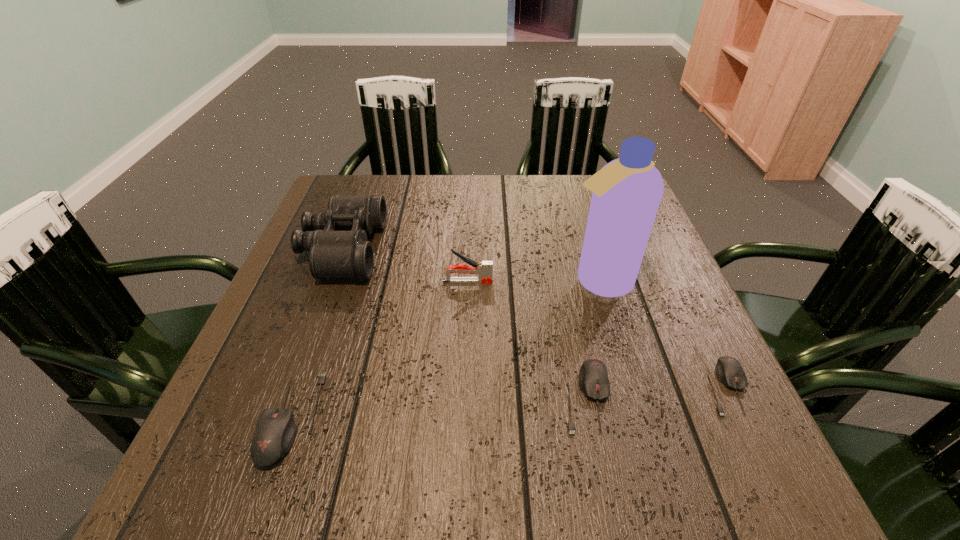
The width and height of the screenshot is (960, 540). In order to click on vacant region located 0.130m on the right of the second mouse from left to right in this screenshot , I will do `click(684, 397)`.

At what (x,y) coordinates should I click in order to perform the action: click on vacant space located 0.280m on the back of the rightmost object. Please return your answer as a coordinate pair (x, y). The width and height of the screenshot is (960, 540). Looking at the image, I should click on (667, 265).

The width and height of the screenshot is (960, 540). What are the coordinates of `free space located 0.060m on the handle side of the fourth object from right to left` in the screenshot? It's located at (518, 281).

At what (x,y) coordinates should I click in order to perform the action: click on vacant region located 0.100m at the eyepieces of the binoculars. Please return your answer as a coordinate pair (x, y). The image size is (960, 540). Looking at the image, I should click on (420, 248).

The height and width of the screenshot is (540, 960). I want to click on vacant area situated 0.250m on the front of the shampoo, so click(635, 404).

Locate an element on the screen. Image resolution: width=960 pixels, height=540 pixels. object positioned at the far edge is located at coordinates (337, 240).

You are a GUI agent. You are given a task and a screenshot of the screen. Output one action in this format:
    pyautogui.click(x=<x>, y=<y>)
    Task: Click on the mouse that is at the left edge
    This screenshot has height=540, width=960.
    Given the screenshot: What is the action you would take?
    pyautogui.click(x=275, y=432)

Identify the location of binoculars that is at the left edge. The image size is (960, 540). (337, 240).

The image size is (960, 540). What are the coordinates of `mouse at the right edge` in the screenshot? It's located at (729, 371).

What are the coordinates of `shampoo present at the right edge` in the screenshot? It's located at point(627,191).